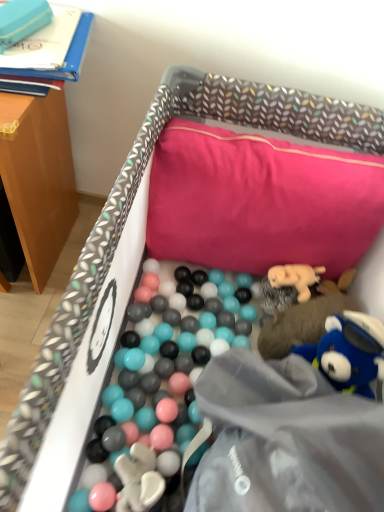
Question: Does soft beige plush bear at center-right, which is counted as the second toy, starting from the left, have a lesser height compared to soft plush bear at upper right, arranged as the third toy when viewed from the left?

Choices:
 (A) no
 (B) yes

Answer: (B)

Question: Is soft beige plush bear at center-right, which is counted as the second toy, starting from the left, far from soft plush bear at upper right, the third toy viewed from the top?

Choices:
 (A) yes
 (B) no

Answer: (B)

Question: Is soft beige plush bear at center-right, arranged as the 3th toy when viewed from the right, at the right side of soft plush bear at upper right, the third toy viewed from the top?

Choices:
 (A) yes
 (B) no

Answer: (B)

Question: Could you tell me if soft beige plush bear at center-right, which is the 2th toy in top-to-bottom order, is turned towards soft plush bear at upper right, the 2th toy from the bottom?

Choices:
 (A) no
 (B) yes

Answer: (B)

Question: Can soft plush bear at upper right, the 2th toy from the bottom, be found inside soft beige plush bear at center-right, which is counted as the second toy, starting from the left?

Choices:
 (A) no
 (B) yes

Answer: (A)

Question: From a real-world perspective, is soft beige plush bear at center-right, arranged as the 3th toy when viewed from the right, beneath soft plush bear at upper right, arranged as the 2th toy when viewed from the right?

Choices:
 (A) no
 (B) yes

Answer: (A)

Question: Is soft plush bear at upper right, arranged as the third toy when viewed from the left, turned away from pink fabric pillow at upper center?

Choices:
 (A) yes
 (B) no

Answer: (B)

Question: Is soft plush bear at upper right, the third toy viewed from the top, not near pink fabric pillow at upper center?

Choices:
 (A) yes
 (B) no

Answer: (B)

Question: Can you confirm if soft plush bear at upper right, arranged as the third toy when viewed from the left, is smaller than pink fabric pillow at upper center?

Choices:
 (A) yes
 (B) no

Answer: (A)

Question: Is pink fabric pillow at upper center located within soft plush bear at upper right, the third toy viewed from the top?

Choices:
 (A) no
 (B) yes

Answer: (A)

Question: From a real-world perspective, does soft plush bear at upper right, the 2th toy from the bottom, stand above pink fabric pillow at upper center?

Choices:
 (A) yes
 (B) no

Answer: (B)

Question: From a real-world perspective, is soft plush bear at upper right, arranged as the third toy when viewed from the left, physically below pink fabric pillow at upper center?

Choices:
 (A) no
 (B) yes

Answer: (B)

Question: Is soft plush bear at upper right, the third toy viewed from the top, turned away from soft beige plush bear at center-right, which is counted as the second toy, starting from the left?

Choices:
 (A) no
 (B) yes

Answer: (B)